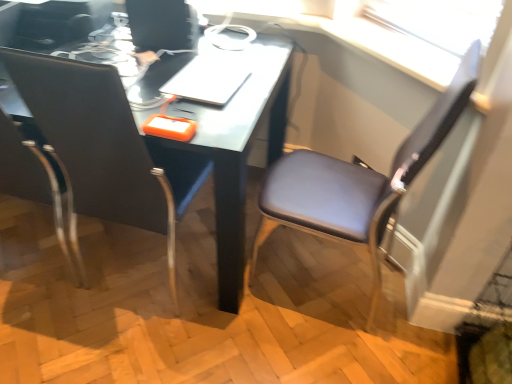
Question: From a real-world perspective, is black leather chair at left, placed as the 1th chair when sorted from left to right, above or below matte black chair at right, the second chair in the left-to-right sequence?

Choices:
 (A) above
 (B) below

Answer: (A)

Question: Considering their positions, is black leather chair at left, the second chair viewed from the right, located in front of or behind matte black chair at right, the 1th chair when ordered from right to left?

Choices:
 (A) behind
 (B) front

Answer: (B)

Question: Choose the correct answer: Is black leather chair at left, placed as the 1th chair when sorted from left to right, inside matte black chair at right, the second chair in the left-to-right sequence, or outside it?

Choices:
 (A) inside
 (B) outside

Answer: (B)

Question: Is matte black chair at right, the second chair in the left-to-right sequence, in front of or behind black leather chair at left, placed as the 1th chair when sorted from left to right, in the image?

Choices:
 (A) front
 (B) behind

Answer: (B)

Question: Is point (348, 173) closer or farther from the camera than point (117, 74)?

Choices:
 (A) closer
 (B) farther

Answer: (B)

Question: Considering the positions of matte black chair at right, the 1th chair when ordered from right to left, and black leather chair at left, placed as the 1th chair when sorted from left to right, in the image, is matte black chair at right, the 1th chair when ordered from right to left, wider or thinner than black leather chair at left, placed as the 1th chair when sorted from left to right,?

Choices:
 (A) thin
 (B) wide

Answer: (A)

Question: From the image's perspective, relative to black leather chair at left, the second chair viewed from the right, is matte black chair at right, the second chair in the left-to-right sequence, above or below?

Choices:
 (A) below
 (B) above

Answer: (A)